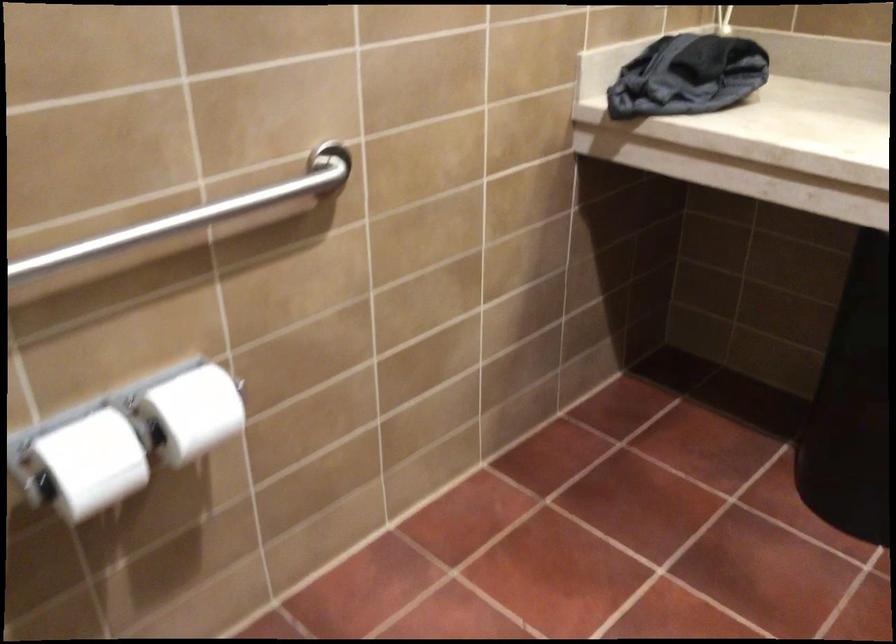
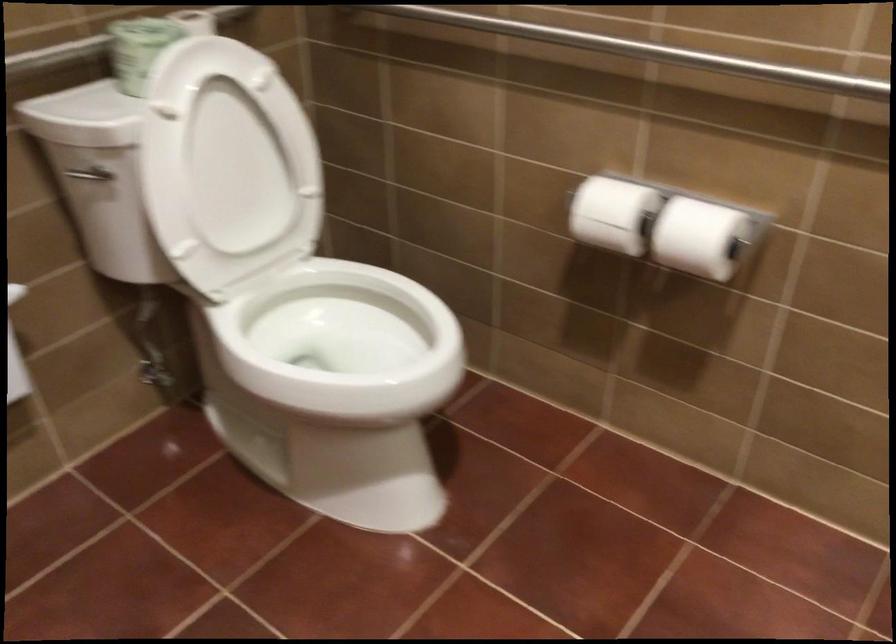
The images are taken continuously from a first-person perspective. In which direction is your viewpoint rotating?

The camera rotated toward left-down.